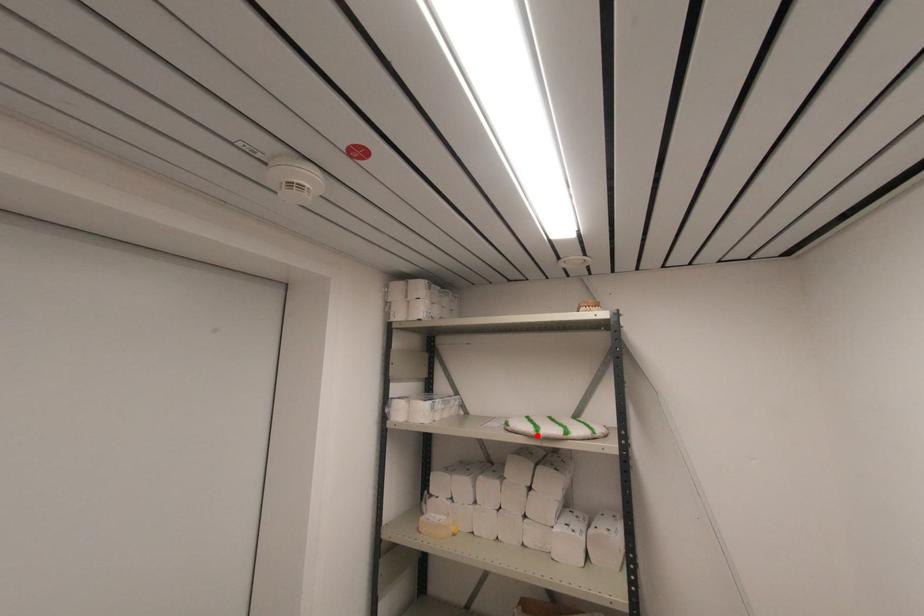
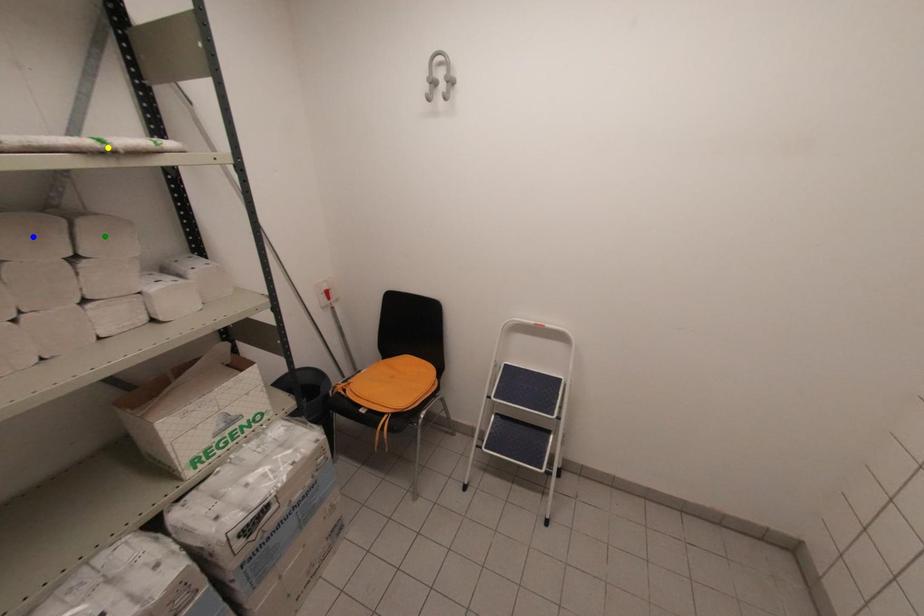
Question: I am providing you with two images of the same scene from different viewpoints. A red point is marked on the first image. You are given multiple points on the second image. Which spot in image 2 lines up with the point in image 1?

Choices:
 (A) yellow point
 (B) green point
 (C) blue point

Answer: (A)